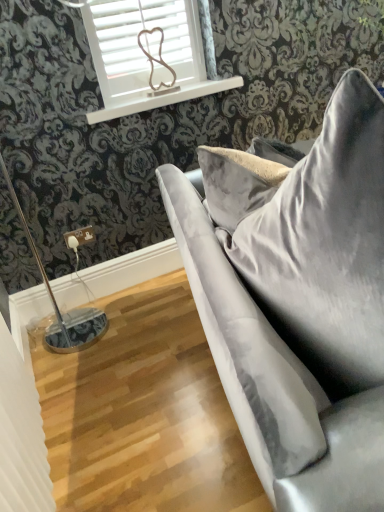
I want to click on velvet grey couch at lower right, so click(x=303, y=311).

Describe the element at coordinates (303, 311) in the screenshot. I see `velvet grey couch at lower right` at that location.

What is the approximate width of velvet grey couch at lower right?

2.37 meters.

This screenshot has height=512, width=384. I want to click on velvet grey couch at lower right, so coord(303,311).